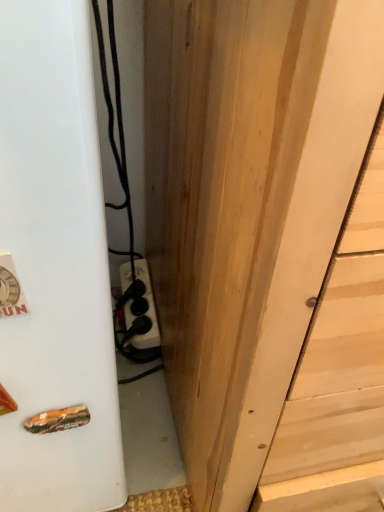
Question: From the image's perspective, would you say white matte refrigerator at left is shown under natural wood door at center?

Choices:
 (A) no
 (B) yes

Answer: (B)

Question: Considering the relative sizes of white matte refrigerator at left and natural wood door at center in the image provided, is white matte refrigerator at left taller than natural wood door at center?

Choices:
 (A) no
 (B) yes

Answer: (A)

Question: Is white matte refrigerator at left turned away from natural wood door at center?

Choices:
 (A) yes
 (B) no

Answer: (B)

Question: Could you tell me if white matte refrigerator at left is turned towards natural wood door at center?

Choices:
 (A) yes
 (B) no

Answer: (B)

Question: Considering the relative positions of white matte refrigerator at left and natural wood door at center in the image provided, is white matte refrigerator at left to the left of natural wood door at center from the viewer's perspective?

Choices:
 (A) no
 (B) yes

Answer: (B)

Question: From a real-world perspective, is white matte refrigerator at left on natural wood door at center?

Choices:
 (A) yes
 (B) no

Answer: (B)

Question: From the image's perspective, is natural wood door at center under white matte refrigerator at left?

Choices:
 (A) no
 (B) yes

Answer: (A)

Question: Is natural wood door at center next to white matte refrigerator at left?

Choices:
 (A) yes
 (B) no

Answer: (B)

Question: Can you confirm if natural wood door at center is smaller than white matte refrigerator at left?

Choices:
 (A) yes
 (B) no

Answer: (B)

Question: From the image's perspective, would you say natural wood door at center is positioned over white matte refrigerator at left?

Choices:
 (A) no
 (B) yes

Answer: (B)

Question: Is natural wood door at center facing away from white matte refrigerator at left?

Choices:
 (A) no
 (B) yes

Answer: (A)

Question: Is natural wood door at center completely or partially outside of white matte refrigerator at left?

Choices:
 (A) yes
 (B) no

Answer: (A)

Question: Is natural wood door at center wider or thinner than white matte refrigerator at left?

Choices:
 (A) thin
 (B) wide

Answer: (B)